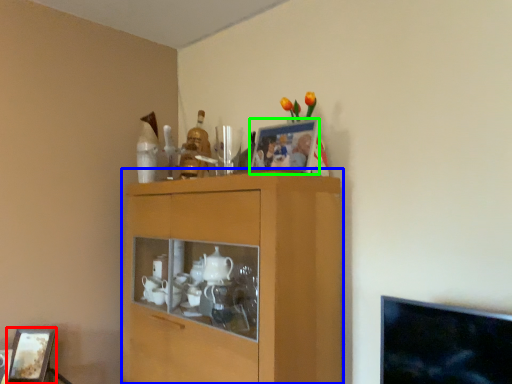
Question: Which object is the closest to the picture frame (highlighted by a red box)? Choose among these: cabinetry (highlighted by a blue box) or picture frame (highlighted by a green box).

Choices:
 (A) cabinetry
 (B) picture frame

Answer: (A)